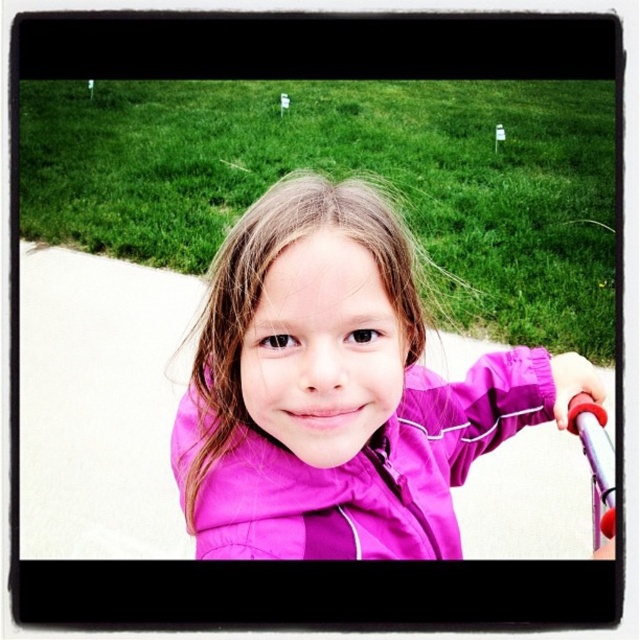
You are a fashion designer observing the image and want to compare the positions of the purple matte jacket at center and the matte purple jacket at center. Which one is higher in the image?

The purple matte jacket at center is higher in the image than the matte purple jacket at center according to the description.

You are standing at the point with coordinates point (452,468) and want to walk towards the girl. Which direction should you move relative to point (266,384)?

To reach the girl, you should move towards point (266,384), which is in front of point (452,468). Since point (266,384) is in front of point (452,468), moving towards it would mean heading in the direction where point (266,384) is located relative to your current position at point (452,468).